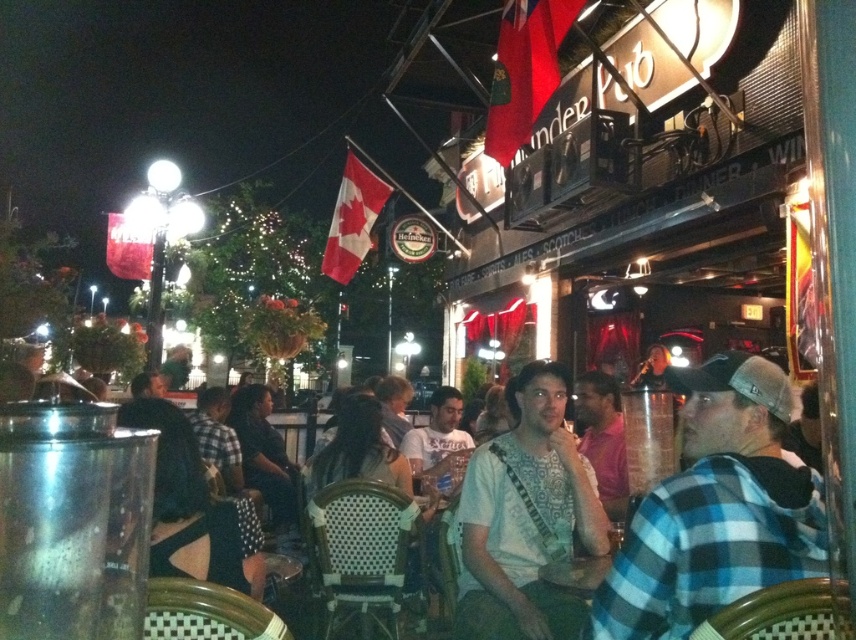
Question: Which of the following is the farthest from the observer?

Choices:
 (A) blue plaid shirt at center
 (B) white cotton t-shirt at center
 (C) white fabric shirt at center

Answer: (B)

Question: Which point is farther to the camera?

Choices:
 (A) white cotton t-shirt at center
 (B) blue plaid shirt at center

Answer: (A)

Question: From the image, what is the correct spatial relationship of white fabric shirt at center in relation to white cotton t-shirt at center?

Choices:
 (A) below
 (B) above

Answer: (B)

Question: Does blue plaid shirt at center appear on the left side of white fabric shirt at center?

Choices:
 (A) no
 (B) yes

Answer: (A)

Question: Which point is closer to the camera taking this photo?

Choices:
 (A) (421, 433)
 (B) (533, 452)
 (C) (642, 620)

Answer: (C)

Question: Observing the image, what is the correct spatial positioning of white fabric shirt at center in reference to white cotton t-shirt at center?

Choices:
 (A) below
 (B) above

Answer: (B)